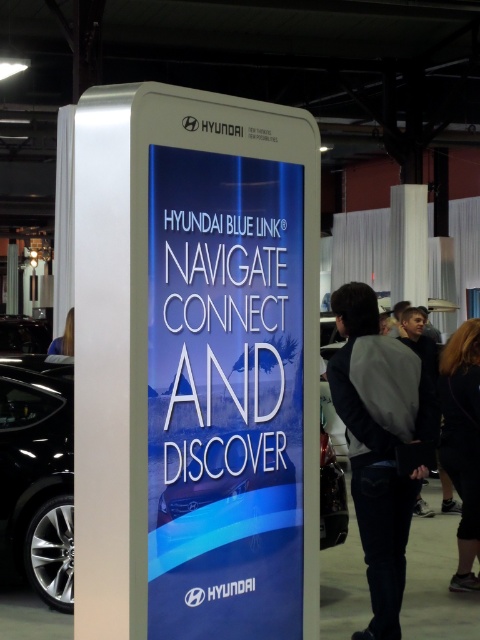
Question: Is white glossy sign at center positioned at the back of gray fleece jacket at center?

Choices:
 (A) no
 (B) yes

Answer: (A)

Question: Where is dark gray jacket at center located in relation to shiny black car at center in the image?

Choices:
 (A) right
 (B) left

Answer: (A)

Question: Can you confirm if shiny black car at center is positioned below brown hair at upper left?

Choices:
 (A) no
 (B) yes

Answer: (B)

Question: Considering the real-world distances, which object is farthest from the shiny black car at center?

Choices:
 (A) black metallic car at lower left
 (B) dark gray jacket at center

Answer: (B)

Question: Which of the following is the farthest from the observer?

Choices:
 (A) white glossy sign at center
 (B) gray fleece jacket at center

Answer: (B)

Question: Which object is positioned closest to the shiny black car at center?

Choices:
 (A) black metallic car at lower left
 (B) dark hair at lower right

Answer: (A)